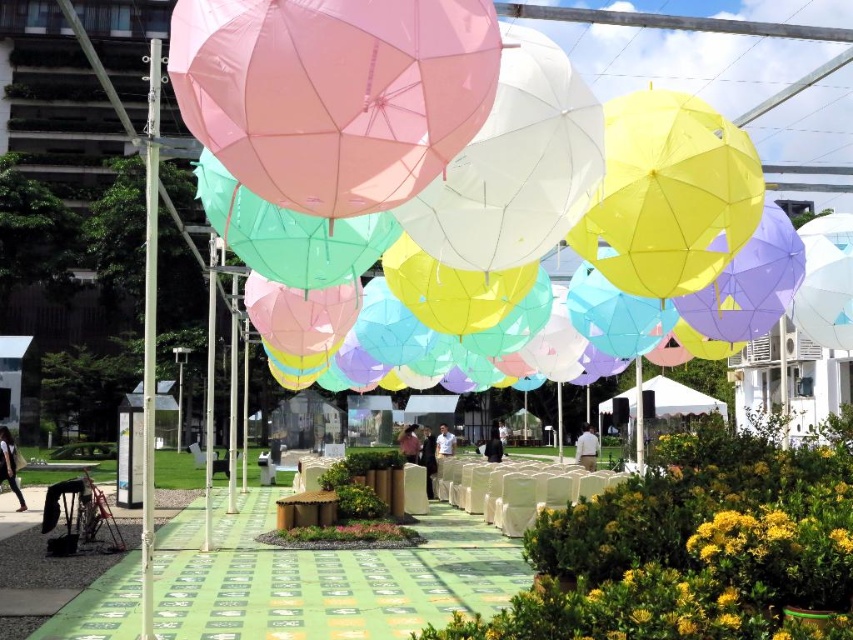
Does matte pink umbrella at upper center have a lesser height compared to white fabric canopy at center?

Indeed, matte pink umbrella at upper center has a lesser height compared to white fabric canopy at center.

This screenshot has height=640, width=853. What are the coordinates of `matte pink umbrella at upper center` in the screenshot? It's located at (334, 92).

Identify the location of matte pink umbrella at upper center. (334, 92).